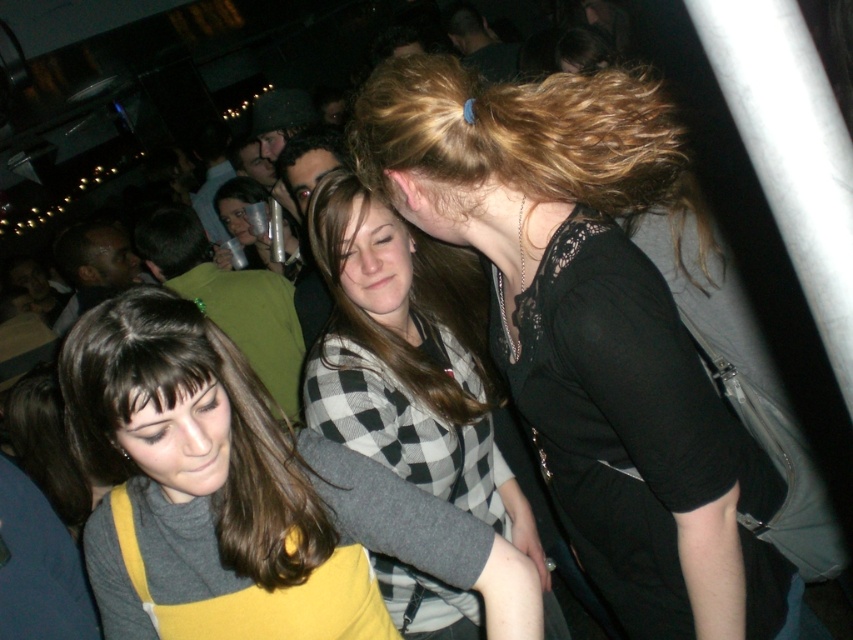
Which is above, black lace dress at center or brownsmoothhair at center?

brownsmoothhair at center is above.

Is black lace dress at center positioned behind brownsmoothhair at center?

That is False.

Which is behind, point (612, 292) or point (366, 200)?

Point (366, 200)

Where is `black lace dress at center`? The width and height of the screenshot is (853, 640). black lace dress at center is located at coordinates (590, 330).

Which is more to the left, matte yellow dress at center or checkered fabric sweater at center?

matte yellow dress at center

Is point (231, 536) behind point (379, 580)?

No.

Where is `matte yellow dress at center`? This screenshot has width=853, height=640. matte yellow dress at center is located at coordinates (248, 492).

Can you confirm if matte yellow dress at center is taller than brownsmoothhair at center?

Yes, matte yellow dress at center is taller than brownsmoothhair at center.

Does matte yellow dress at center lie behind brownsmoothhair at center?

No, matte yellow dress at center is closer to the viewer.

You are a GUI agent. You are given a task and a screenshot of the screen. Output one action in this format:
    pyautogui.click(x=<x>, y=<y>)
    Task: Click on the matte yellow dress at center
    This screenshot has width=853, height=640.
    Given the screenshot: What is the action you would take?
    pyautogui.click(x=248, y=492)